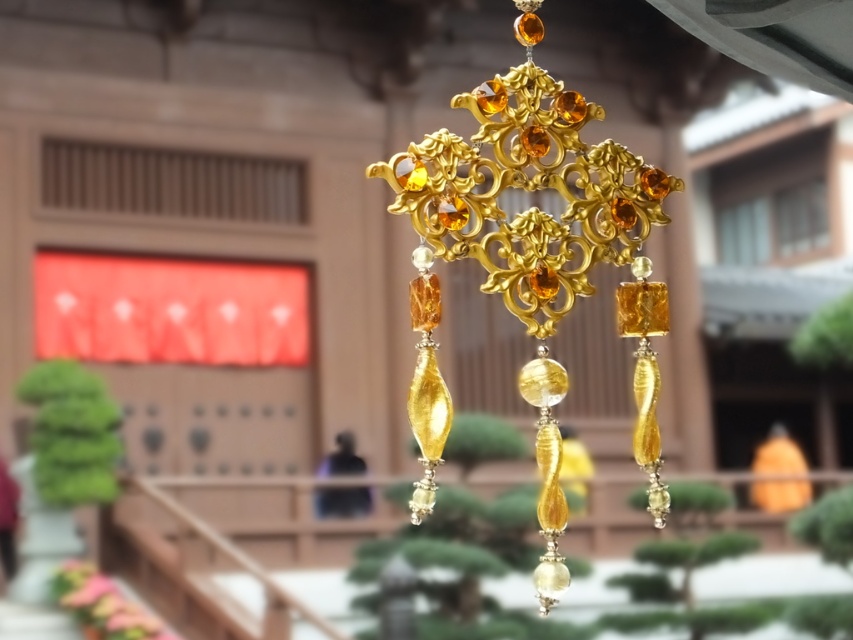
Based on the photo, you are standing in front of the decorative hanging ornament. There is a gold metallic cross at center located at point [534,257]. If you want to hang a new ornament exactly 0.1 units to the right of the gold metallic cross at center, what coordinate would you use?

The gold metallic cross at center is located at point [534,257]. To hang a new ornament 0.1 units to the right, add 0.1 to the x coordinate. The new coordinate would be 0.502, 0.627.

Looking at this image, you are an interior designer planning to hang the gold metallic cross at center in a room. The room has a ceiling height of 2.5 meters. If the cross is placed at coordinates 0.402, 0.627, will its bottom edge be above or below the standard eye level of 1.6 meters?

The gold metallic cross at center is located at point [534,257]. Since the y coordinate 0.627 represents 62.7 percent of the ceiling height, the bottom edge would be at approximately 2.5 m x 0.627 x 2.5 m? Wait, maybe I need to clarify how coordinates translate to actual measurements. Hmm, perhaps the coordinates are normalized between 0 and 1, so 0.627 would be 62.7 cm from the bottom if the total height is 100 cm? But the ceiling is 2.5 meters, so 0.627 of that is about 1.5675 meters. Since eye level 1